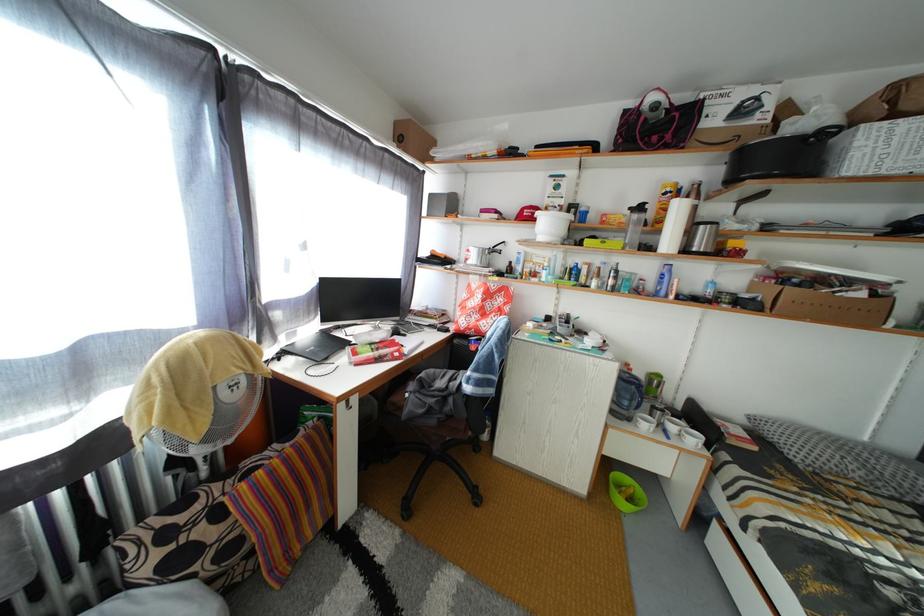
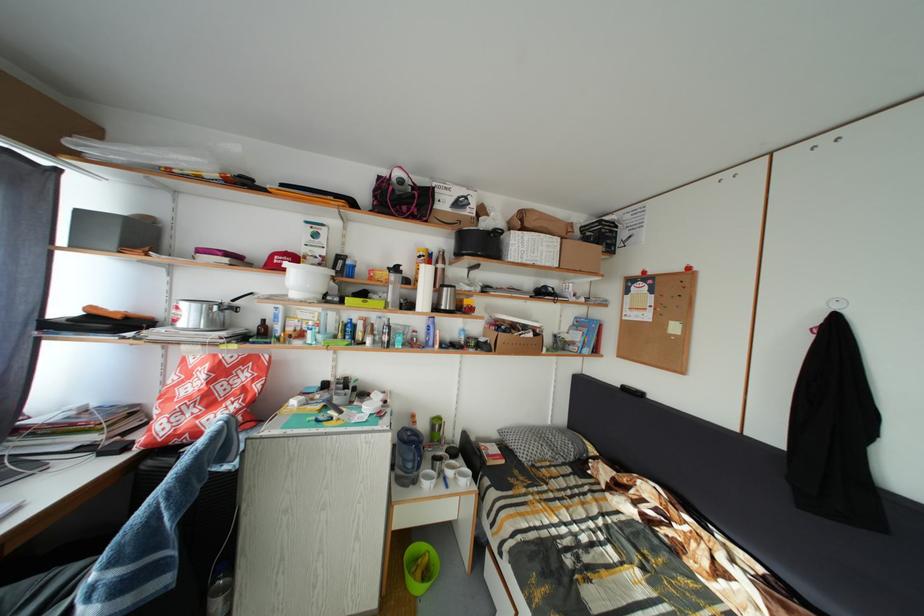
Locate, in the second image, the point that corresponds to the point at 870,301 in the first image.

(540, 341)